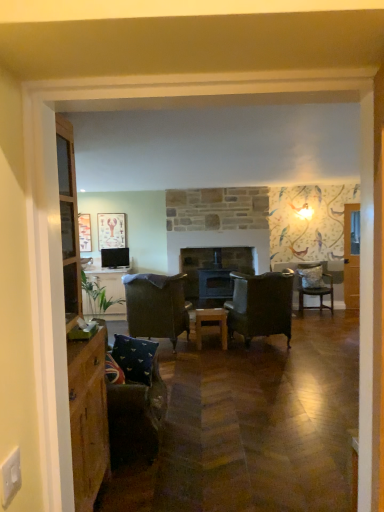
Measure the distance between point (254,289) and camera.

Point (254,289) and camera are 18.39 feet apart.

Describe the element at coordinates (85, 232) in the screenshot. I see `wooden picture frame at left, which is counted as the first picture frame, starting from the left` at that location.

This screenshot has height=512, width=384. I want to click on velvet dark brown chair at right, the 3th chair when ordered from front to back, so click(x=314, y=286).

This screenshot has width=384, height=512. I want to click on wooden table at center, so click(211, 324).

Between point (101, 256) and point (302, 288), which one is positioned behind?

The point (302, 288) is farther from the camera.

Is matte black television at upper left turned away from velvet dark brown chair at right, the 3th chair when ordered from front to back?

matte black television at upper left is not turned away from velvet dark brown chair at right, the 3th chair when ordered from front to back.

Is wooden table at center located within leather armchair at center, which is counted as the third chair, starting from the back?

No, wooden table at center is not a part of leather armchair at center, which is counted as the third chair, starting from the back.

Considering the sizes of objects leather armchair at center, which is counted as the third chair, starting from the back, and wooden table at center in the image provided, who is shorter, leather armchair at center, which is counted as the third chair, starting from the back, or wooden table at center?

With less height is wooden table at center.

Is leather armchair at center, which is counted as the third chair, starting from the back, bigger than wooden table at center?

Correct, leather armchair at center, which is counted as the third chair, starting from the back, is larger in size than wooden table at center.

Is leather armchair at center, the second chair when ordered from right to left, far away from wooden table at center?

That's not correct — leather armchair at center, the second chair when ordered from right to left, is a little close to wooden table at center.

Does velvet dark brown armchair at center, the second chair viewed from the front, have a greater height compared to wooden stove at center?

No.

Considering the sizes of velvet dark brown armchair at center, which appears as the 3th chair when viewed from the right, and wooden stove at center in the image, is velvet dark brown armchair at center, which appears as the 3th chair when viewed from the right, bigger or smaller than wooden stove at center?

Considering their sizes, velvet dark brown armchair at center, which appears as the 3th chair when viewed from the right, takes up more space than wooden stove at center.

Is velvet dark brown armchair at center, acting as the second chair starting from the back, facing away from wooden stove at center?

No, velvet dark brown armchair at center, acting as the second chair starting from the back, is not facing the opposite direction of wooden stove at center.

Is wooden stove at center located within velvet dark brown armchair at center, which appears as the 3th chair when viewed from the right?

No, wooden stove at center is not inside velvet dark brown armchair at center, which appears as the 3th chair when viewed from the right.

Which of these two, matte wooden picture frame at upper left, acting as the first picture frame starting from the right, or wooden table at center, is bigger?

wooden table at center is bigger.

Considering the positions of objects matte wooden picture frame at upper left, acting as the first picture frame starting from the right, and wooden table at center in the image provided, who is in front, matte wooden picture frame at upper left, acting as the first picture frame starting from the right, or wooden table at center?

wooden table at center is in front.

From the image's perspective, is matte wooden picture frame at upper left, acting as the first picture frame starting from the right, located beneath wooden table at center?

Actually, matte wooden picture frame at upper left, acting as the first picture frame starting from the right, appears above wooden table at center in the image.

From the image's perspective, between leather armchair at center, the second chair when ordered from right to left, and wooden stove at center, which one is located above?

wooden stove at center is shown above in the image.

Is the surface of leather armchair at center, the 1th chair from the front, in direct contact with wooden stove at center?

They are not placed beside each other.

Considering the sizes of leather armchair at center, which is counted as the third chair, starting from the back, and wooden stove at center in the image, is leather armchair at center, which is counted as the third chair, starting from the back, wider or thinner than wooden stove at center?

leather armchair at center, which is counted as the third chair, starting from the back, is wider than wooden stove at center.

At what (x,y) coordinates should I click in order to perform the action: click on fireplace lying above the leather armchair at center, the second chair when ordered from right to left (from the image's perspective). Please return your answer as a coordinate pair (x, y). Image resolution: width=384 pixels, height=512 pixels. Looking at the image, I should click on (213, 270).

Considering the positions of point (233, 259) and point (80, 216), is point (233, 259) closer or farther from the camera than point (80, 216)?

Clearly, point (233, 259) is more distant from the camera than point (80, 216).

How many degrees apart are the facing directions of wooden stove at center and wooden picture frame at left, which is counted as the first picture frame, starting from the left?

There is a 0.857-degree angle between the facing directions of wooden stove at center and wooden picture frame at left, which is counted as the first picture frame, starting from the left.

Which object is thinner, wooden stove at center or wooden picture frame at left, the second picture frame in the right-to-left sequence?

Thinner between the two is wooden picture frame at left, the second picture frame in the right-to-left sequence.

Is wooden stove at center oriented away from wooden picture frame at left, the second picture frame in the right-to-left sequence?

wooden stove at center is not turned away from wooden picture frame at left, the second picture frame in the right-to-left sequence.

From the image's perspective, which one is positioned lower, velvet dark brown chair at right, acting as the third chair starting from the left, or wooden picture frame at left, the second picture frame in the right-to-left sequence?

velvet dark brown chair at right, acting as the third chair starting from the left, from the image's perspective.

Is wooden picture frame at left, which is counted as the first picture frame, starting from the left, at the back of velvet dark brown chair at right, the 3th chair when ordered from front to back?

No, velvet dark brown chair at right, the 3th chair when ordered from front to back, is not facing the opposite direction of wooden picture frame at left, which is counted as the first picture frame, starting from the left.

In terms of height, does velvet dark brown chair at right, positioned as the first chair in back-to-front order, look taller or shorter compared to wooden picture frame at left, which is counted as the first picture frame, starting from the left?

Considering their sizes, velvet dark brown chair at right, positioned as the first chair in back-to-front order, has more height than wooden picture frame at left, which is counted as the first picture frame, starting from the left.

From the image's perspective, count 1st chairs downward from the matte black television at upper left and point to it. Please provide its 2D coordinates.

[(314, 286)]

Locate an element on the screen. The width and height of the screenshot is (384, 512). table below the leather armchair at center, acting as the second chair starting from the left (from a real-world perspective) is located at coordinates (211, 324).

From the image, which object appears to be nearer to wooden picture frame at left, the second picture frame in the right-to-left sequence, matte black television at upper left or velvet dark brown armchair at center, the second chair viewed from the front?

matte black television at upper left.

When comparing their distances from wooden table at center, does velvet dark brown chair at right, acting as the third chair starting from the left, or velvet dark brown armchair at center, acting as the second chair starting from the back, seem closer?

velvet dark brown armchair at center, acting as the second chair starting from the back, is positioned closer to the anchor wooden table at center.

From the picture: When comparing their distances from wooden picture frame at left, which is counted as the first picture frame, starting from the left, does blue fabric pillow at lower left or leather armchair at center, the 1th chair from the front, seem further?

Among the two, blue fabric pillow at lower left is located further to wooden picture frame at left, which is counted as the first picture frame, starting from the left.

From the image, which object appears to be farther from wooden table at center, velvet dark brown armchair at center, the first chair positioned from the left, or matte black television at upper left?

Among the two, matte black television at upper left is located further to wooden table at center.

When comparing their distances from wooden stove at center, does matte wooden picture frame at upper left, acting as the first picture frame starting from the right, or matte black television at upper left seem further?

matte wooden picture frame at upper left, acting as the first picture frame starting from the right, is further to wooden stove at center.

Which object lies nearer to the anchor point wooden stove at center, matte black television at upper left or blue fabric pillow at lower left?

Based on the image, matte black television at upper left appears to be nearer to wooden stove at center.

From the picture: Looking at the image, which one is located closer to wooden stove at center, velvet dark brown armchair at center, acting as the second chair starting from the back, or wooden table at center?

velvet dark brown armchair at center, acting as the second chair starting from the back, is positioned closer to the anchor wooden stove at center.

Consider the image. Based on their spatial positions, is matte black television at upper left or wooden table at center further from matte wooden picture frame at upper left, the second picture frame in the left-to-right sequence?

Among the two, wooden table at center is located further to matte wooden picture frame at upper left, the second picture frame in the left-to-right sequence.

Locate an element on the screen. table between blue fabric pillow at lower left and wooden stove at center in the front-back direction is located at coordinates (211, 324).

Locate an element on the screen. fireplace between matte wooden picture frame at upper left, acting as the first picture frame starting from the right, and velvet dark brown chair at right, the 1th chair from the right, in the horizontal direction is located at coordinates (213, 270).

Locate an element on the screen. Image resolution: width=384 pixels, height=512 pixels. picture frame between blue fabric pillow at lower left and wooden picture frame at left, which is counted as the first picture frame, starting from the left, from front to back is located at coordinates (111, 230).

Image resolution: width=384 pixels, height=512 pixels. I want to click on fireplace situated between wooden picture frame at left, the second picture frame in the right-to-left sequence, and velvet dark brown chair at right, the 1th chair from the right, from left to right, so click(x=213, y=270).